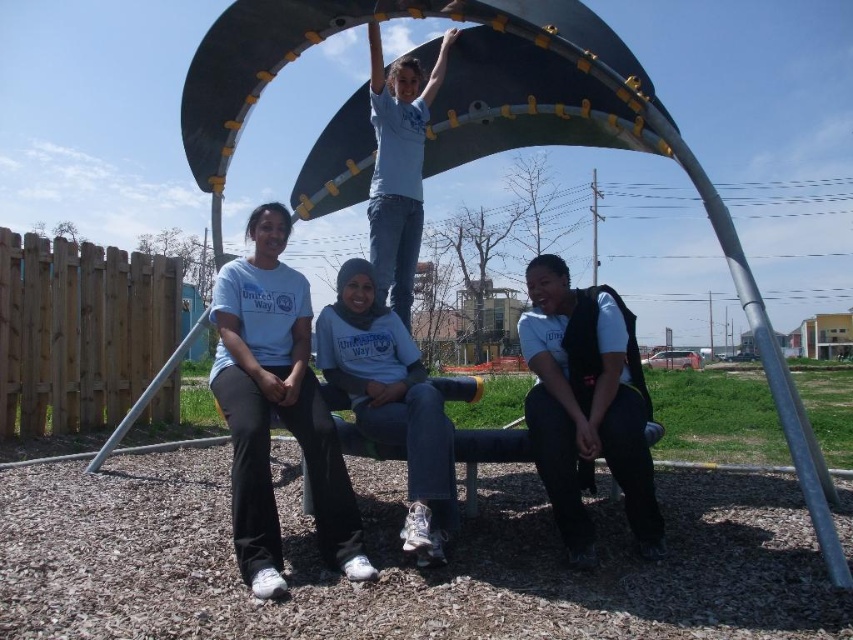
Is white matte pants at lower left to the left of gray matte hoodie at center from the viewer's perspective?

Indeed, white matte pants at lower left is positioned on the left side of gray matte hoodie at center.

Does point (303, 388) lie in front of point (403, 360)?

Yes, it is in front of point (403, 360).

You are a GUI agent. You are given a task and a screenshot of the screen. Output one action in this format:
    pyautogui.click(x=<x>, y=<y>)
    Task: Click on the white matte pants at lower left
    The width and height of the screenshot is (853, 640).
    Given the screenshot: What is the action you would take?
    pyautogui.click(x=276, y=406)

Which is in front, point (323, 492) or point (558, 458)?

Point (558, 458) is in front.

Does white matte pants at lower left appear over black matte vest at lower right?

Yes.

Between point (265, 500) and point (642, 408), which one is positioned behind?

Point (642, 408)

Identify the location of white matte pants at lower left. (276, 406).

Can you confirm if black matte vest at lower right is shorter than white matte shirt at upper center?

Yes.

Does black matte vest at lower right appear over white matte shirt at upper center?

Actually, black matte vest at lower right is below white matte shirt at upper center.

Who is more forward, (601, 432) or (376, 253)?

Point (601, 432) is more forward.

Find the location of `black matte vest at lower right`. black matte vest at lower right is located at coordinates (585, 404).